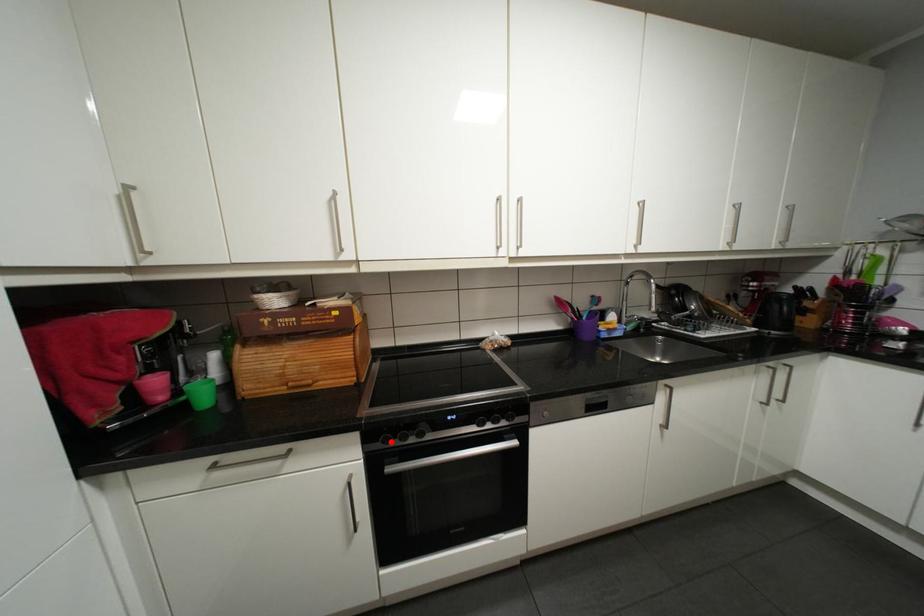
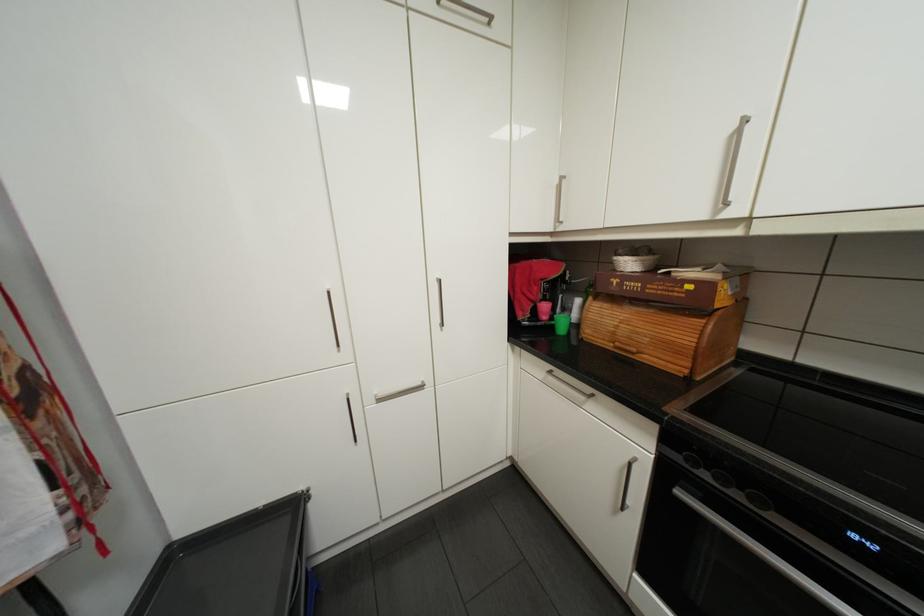
Question: I am providing you with two images of the same scene from different viewpoints. A red point is shown in image1. For the corresponding object point in image2, is it positioned nearer or farther from the camera?

Choices:
 (A) Nearer
 (B) Farther

Answer: (A)